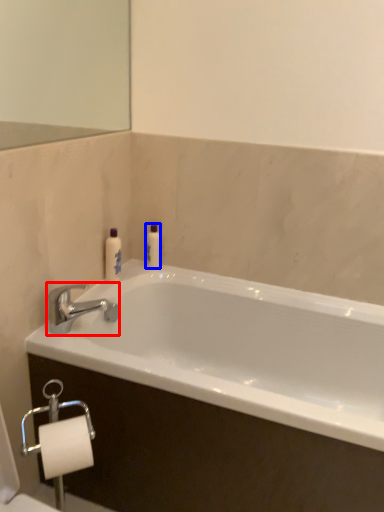
Question: Which of the following is the closest to the observer, tap (highlighted by a red box) or toiletry (highlighted by a blue box)?

Choices:
 (A) tap
 (B) toiletry

Answer: (A)